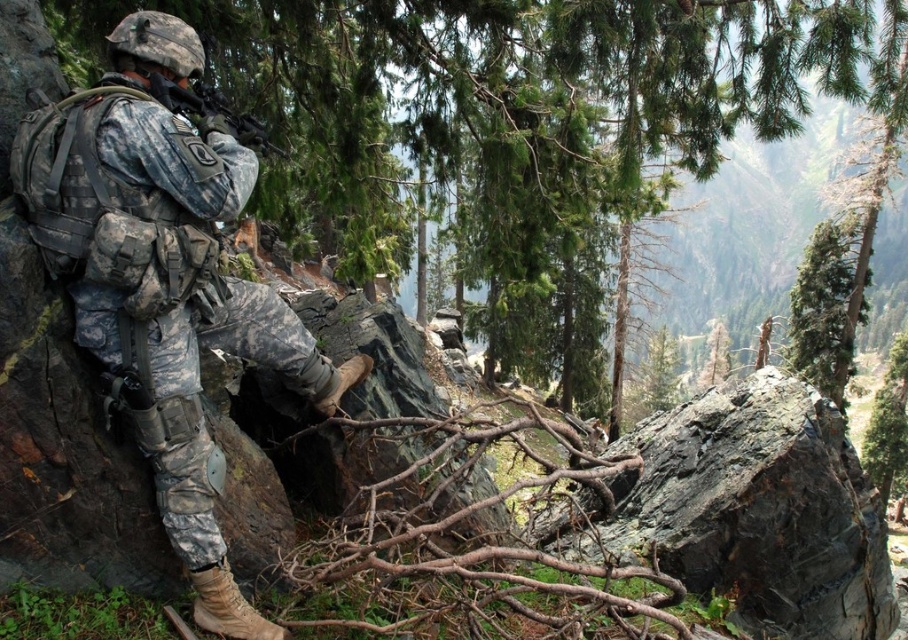
As an observer looking at the image, can you determine the exact 2D coordinates of the camouflage fabric uniform at left?

The camouflage fabric uniform at left is located at the 2D coordinates of point [163,275].

You are an observer in the forest. You notice the camouflage fabric uniform at left and the green rough bark tree at upper right. Which object is wider?

The camouflage fabric uniform at left is narrower than the green rough bark tree at upper right, so the green rough bark tree at upper right is wider.

You are a military analyst observing a soldier in a forested mountain area. The soldier is wearing a camouflage fabric uniform at left and holding a matte black rifle at center. Based on their positioning, which object is lower in the image?

The camouflage fabric uniform at left is below the matte black rifle at center, so the camouflage fabric uniform at left is lower in the image.